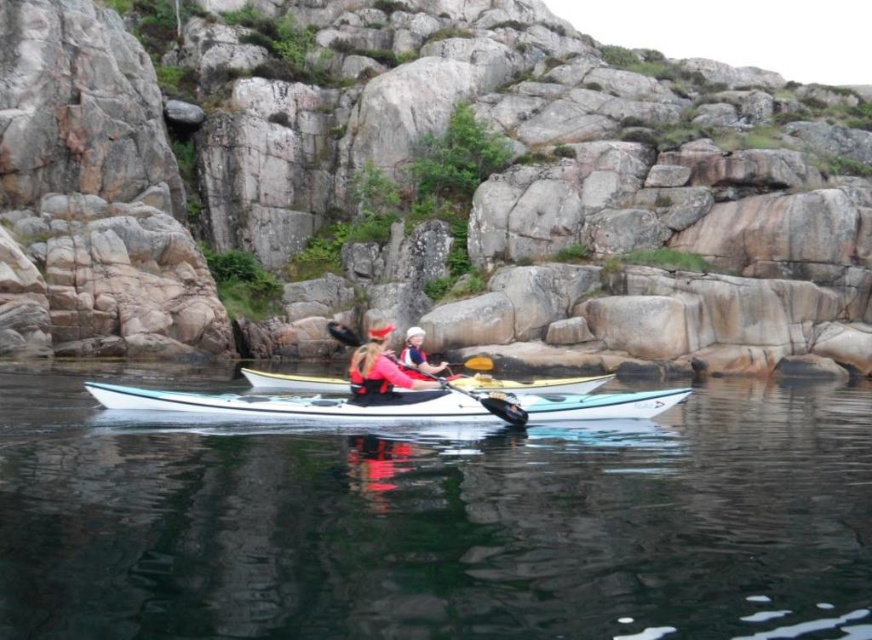
Question: Is the position of matte pink life jacket at center less distant than that of matte red life vest at center?

Choices:
 (A) yes
 (B) no

Answer: (A)

Question: Estimate the real-world distances between objects in this image. Which object is closer to the white glossy canoe at center?

Choices:
 (A) yellow plastic paddle at center
 (B) clear water at center

Answer: (A)

Question: Which point is farther to the camera?

Choices:
 (A) white glossy kayak at center
 (B) yellow plastic paddle at center

Answer: (B)

Question: In this image, where is white glossy kayak at center located relative to matte pink life jacket at center?

Choices:
 (A) left
 (B) right

Answer: (B)

Question: Is matte pink life jacket at center further to camera compared to matte red life vest at center?

Choices:
 (A) no
 (B) yes

Answer: (A)

Question: Among these points, which one is nearest to the camera?

Choices:
 (A) (561, 404)
 (B) (410, 342)
 (C) (502, 397)

Answer: (C)